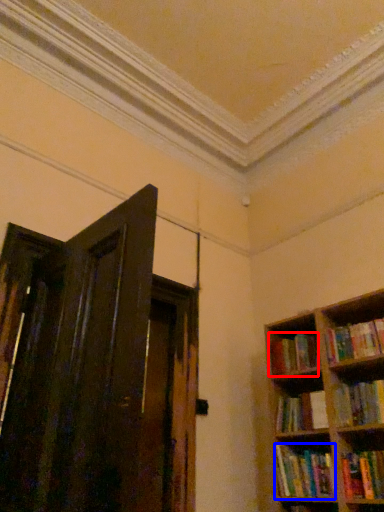
Question: Which point is closer to the camera, book (highlighted by a red box) or book (highlighted by a blue box)?

Choices:
 (A) book
 (B) book

Answer: (B)